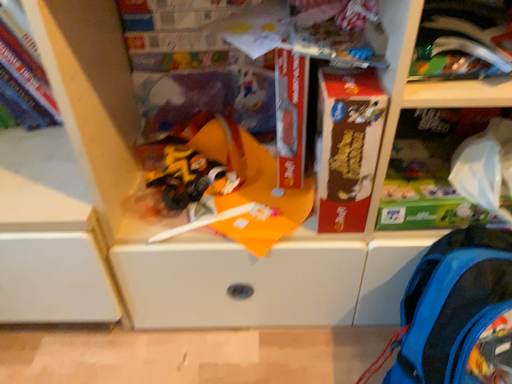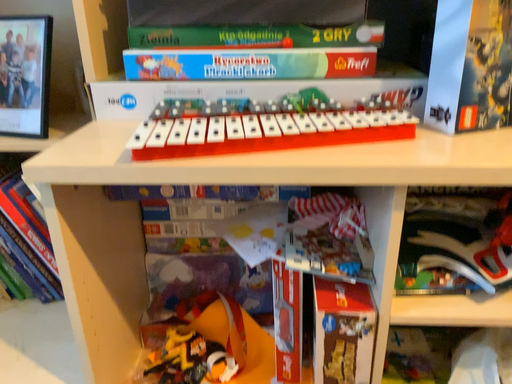
Question: Which way did the camera rotate in the video?

Choices:
 (A) rotated upward
 (B) rotated downward

Answer: (A)